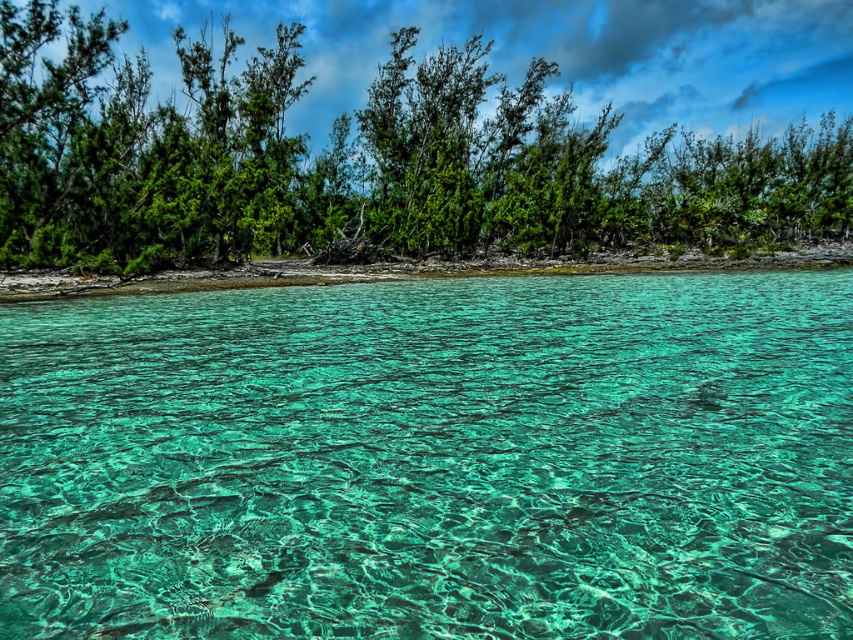
Does point (701, 307) come farther from viewer compared to point (486, 118)?

No.

Is translucent teal water at center to the right of green leafy trees at upper center from the viewer's perspective?

No, translucent teal water at center is not to the right of green leafy trees at upper center.

Between point (86, 481) and point (779, 150), which one is positioned in front?

Point (86, 481)

Find the location of `translucent teal water at center`. translucent teal water at center is located at coordinates (432, 460).